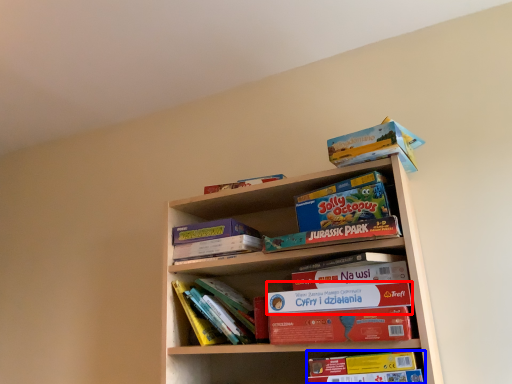
Question: Which of the following is the closest to the observer, paperback book (highlighted by a red box) or book (highlighted by a blue box)?

Choices:
 (A) paperback book
 (B) book

Answer: (B)